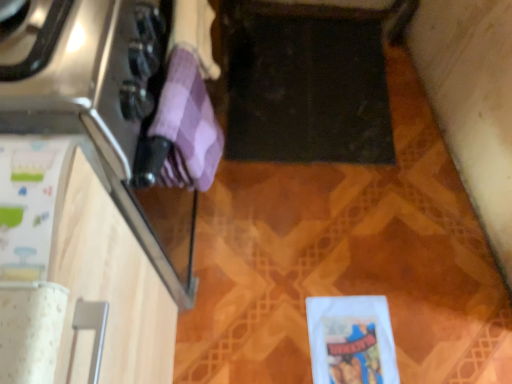
What is the approximate height of white paper at left, marked as the 2th wrapping paper in a top-to-bottom arrangement?

white paper at left, marked as the 2th wrapping paper in a top-to-bottom arrangement, is 2.13 inches tall.

This screenshot has height=384, width=512. What do you see at coordinates (187, 125) in the screenshot? I see `purple checkered towel at left, positioned as the 1th wrapping paper in top-to-bottom order` at bounding box center [187, 125].

Measure the distance between white matte wrapping paper at lower right, marked as the 1th wrapping paper in a bottom-to-top arrangement, and camera.

They are 1.06 meters apart.

Image resolution: width=512 pixels, height=384 pixels. I want to click on white paper at left, marked as the 2th wrapping paper in a top-to-bottom arrangement, so click(x=30, y=203).

From a real-world perspective, which is physically below, white paper at left, marked as the 2th wrapping paper in a top-to-bottom arrangement, or white matte wrapping paper at lower right, the 3th wrapping paper from the left?

From a 3D spatial view, white matte wrapping paper at lower right, the 3th wrapping paper from the left, is below.

Which point is more distant from viewer, [52,219] or [386,316]?

The point [386,316] is behind.

Does white paper at left, which appears as the 2th wrapping paper when ordered from the bottom, have a smaller size compared to white matte wrapping paper at lower right, placed as the first wrapping paper when sorted from right to left?

Incorrect, white paper at left, which appears as the 2th wrapping paper when ordered from the bottom, is not smaller in size than white matte wrapping paper at lower right, placed as the first wrapping paper when sorted from right to left.

Looking at this image, is white paper at left, the third wrapping paper in the right-to-left sequence, looking in the opposite direction of white matte wrapping paper at lower right, placed as the first wrapping paper when sorted from right to left?

No, white paper at left, the third wrapping paper in the right-to-left sequence,'s orientation is not away from white matte wrapping paper at lower right, placed as the first wrapping paper when sorted from right to left.

Do you think white matte wrapping paper at lower right, which is counted as the 3th wrapping paper, starting from the front, is within purple checkered towel at left, positioned as the 1th wrapping paper in top-to-bottom order, or outside of it?

white matte wrapping paper at lower right, which is counted as the 3th wrapping paper, starting from the front, is spatially situated outside purple checkered towel at left, positioned as the 1th wrapping paper in top-to-bottom order.

From a real-world perspective, between white matte wrapping paper at lower right, marked as the 1th wrapping paper in a bottom-to-top arrangement, and purple checkered towel at left, the 2th wrapping paper positioned from the front, who is vertically lower?

white matte wrapping paper at lower right, marked as the 1th wrapping paper in a bottom-to-top arrangement, is physically lower.

Is white matte wrapping paper at lower right, positioned as the first wrapping paper in back-to-front order, oriented towards purple checkered towel at left, positioned as the 1th wrapping paper in top-to-bottom order?

No, white matte wrapping paper at lower right, positioned as the first wrapping paper in back-to-front order, is not turned towards purple checkered towel at left, positioned as the 1th wrapping paper in top-to-bottom order.

Which of these two, white matte wrapping paper at lower right, positioned as the first wrapping paper in back-to-front order, or purple checkered towel at left, which is the 3th wrapping paper in bottom-to-top order, stands taller?

Standing taller between the two is purple checkered towel at left, which is the 3th wrapping paper in bottom-to-top order.

In the scene shown: From a real-world perspective, between white paper at left, which appears as the 2th wrapping paper when ordered from the bottom, and purple checkered towel at left, the 2th wrapping paper positioned from the front, who is vertically higher?

In real-world perspective, white paper at left, which appears as the 2th wrapping paper when ordered from the bottom, is above.

How different are the orientations of white paper at left, which is the first wrapping paper from front to back, and purple checkered towel at left, positioned as the 1th wrapping paper in top-to-bottom order, in degrees?

white paper at left, which is the first wrapping paper from front to back, and purple checkered towel at left, positioned as the 1th wrapping paper in top-to-bottom order, are facing 9.35 degrees away from each other.

Which wrapping paper is the 1st one when counting from the right side of the white paper at left, marked as the 2th wrapping paper in a top-to-bottom arrangement? Please provide its 2D coordinates.

[(187, 125)]

Considering the positions of points (40, 172) and (151, 133), is point (40, 172) closer to camera compared to point (151, 133)?

That is True.

Could you tell me if white matte wrapping paper at lower right, placed as the first wrapping paper when sorted from right to left, is turned towards white paper at left, which appears as the 2th wrapping paper when ordered from the bottom?

No, white matte wrapping paper at lower right, placed as the first wrapping paper when sorted from right to left, is not facing towards white paper at left, which appears as the 2th wrapping paper when ordered from the bottom.

Which is in front, point (361, 349) or point (17, 189)?

Point (17, 189)

From the picture: Between white matte wrapping paper at lower right, positioned as the first wrapping paper in back-to-front order, and white paper at left, marked as the 1th wrapping paper in a left-to-right arrangement, which one has larger width?

white paper at left, marked as the 1th wrapping paper in a left-to-right arrangement, is wider.

From the picture: Does white matte wrapping paper at lower right, which is counted as the 3th wrapping paper, starting from the front, have a larger size compared to white paper at left, marked as the 1th wrapping paper in a left-to-right arrangement?

No.

Between purple checkered towel at left, the 2th wrapping paper positioned from the front, and white matte wrapping paper at lower right, positioned as the first wrapping paper in back-to-front order, which one appears on the right side from the viewer's perspective?

Positioned to the right is white matte wrapping paper at lower right, positioned as the first wrapping paper in back-to-front order.

Is point (193, 113) in front of point (342, 373)?

Yes, point (193, 113) is closer to viewer.

Is purple checkered towel at left, which is the 3th wrapping paper in bottom-to-top order, next to white matte wrapping paper at lower right, the 3th wrapping paper from the left, and touching it?

No.

Is purple checkered towel at left, positioned as the 1th wrapping paper in top-to-bottom order, oriented towards white matte wrapping paper at lower right, marked as the 1th wrapping paper in a bottom-to-top arrangement?

No, purple checkered towel at left, positioned as the 1th wrapping paper in top-to-bottom order, is not turned towards white matte wrapping paper at lower right, marked as the 1th wrapping paper in a bottom-to-top arrangement.

Is purple checkered towel at left, which is the 3th wrapping paper in bottom-to-top order, bigger than white paper at left, which is the first wrapping paper from front to back?

No, purple checkered towel at left, which is the 3th wrapping paper in bottom-to-top order, is not bigger than white paper at left, which is the first wrapping paper from front to back.

From the image's perspective, does purple checkered towel at left, which is the 3th wrapping paper in bottom-to-top order, appear higher than white paper at left, which is the first wrapping paper from front to back?

Yes, from the image's perspective, purple checkered towel at left, which is the 3th wrapping paper in bottom-to-top order, is over white paper at left, which is the first wrapping paper from front to back.

Which is in front, purple checkered towel at left, positioned as the 1th wrapping paper in top-to-bottom order, or white paper at left, marked as the 1th wrapping paper in a left-to-right arrangement?

Positioned in front is white paper at left, marked as the 1th wrapping paper in a left-to-right arrangement.

Visually, is purple checkered towel at left, positioned as the 1th wrapping paper in top-to-bottom order, positioned to the left or to the right of white paper at left, which appears as the 2th wrapping paper when ordered from the bottom?

In the image, purple checkered towel at left, positioned as the 1th wrapping paper in top-to-bottom order, appears on the right side of white paper at left, which appears as the 2th wrapping paper when ordered from the bottom.

At what (x,y) coordinates should I click in order to perform the action: click on wrapping paper that is the 2nd object to the right of the white paper at left, which appears as the 2th wrapping paper when ordered from the bottom, starting at the anchor. Please return your answer as a coordinate pair (x, y). Looking at the image, I should click on (351, 340).

This screenshot has width=512, height=384. In the image, there is a purple checkered towel at left, which is the 3th wrapping paper in bottom-to-top order. Identify the location of wrapping paper below it (from a real-world perspective). (351, 340).

Considering their positions, is white matte wrapping paper at lower right, marked as the 1th wrapping paper in a bottom-to-top arrangement, positioned closer to purple checkered towel at left, which is the second wrapping paper from back to front, than white paper at left, which is the third wrapping paper in back-to-front order?

white paper at left, which is the third wrapping paper in back-to-front order, is closer to purple checkered towel at left, which is the second wrapping paper from back to front.

From the image, which object appears to be farther from white paper at left, which is the first wrapping paper from front to back, purple checkered towel at left, which appears as the 2th wrapping paper when viewed from the right, or white matte wrapping paper at lower right, which is counted as the 3th wrapping paper, starting from the front?

white matte wrapping paper at lower right, which is counted as the 3th wrapping paper, starting from the front.

Which object lies nearer to the anchor point white matte wrapping paper at lower right, positioned as the first wrapping paper in back-to-front order, white paper at left, which is the first wrapping paper from front to back, or purple checkered towel at left, which appears as the 2th wrapping paper when viewed from the right?

purple checkered towel at left, which appears as the 2th wrapping paper when viewed from the right, lies closer to white matte wrapping paper at lower right, positioned as the first wrapping paper in back-to-front order, than the other object.

Which object lies further to the anchor point purple checkered towel at left, the 2th wrapping paper positioned from the front, white paper at left, which is the first wrapping paper from front to back, or white matte wrapping paper at lower right, the 3th wrapping paper from the left?

Among the two, white matte wrapping paper at lower right, the 3th wrapping paper from the left, is located further to purple checkered towel at left, the 2th wrapping paper positioned from the front.

Considering their positions, is white matte wrapping paper at lower right, marked as the 1th wrapping paper in a bottom-to-top arrangement, positioned further to white paper at left, which appears as the 2th wrapping paper when ordered from the bottom, than purple checkered towel at left, which appears as the 2th wrapping paper when viewed from the right?

The object further to white paper at left, which appears as the 2th wrapping paper when ordered from the bottom, is white matte wrapping paper at lower right, marked as the 1th wrapping paper in a bottom-to-top arrangement.

Considering their positions, is purple checkered towel at left, which appears as the 2th wrapping paper when viewed from the right, positioned closer to white matte wrapping paper at lower right, which is counted as the 3th wrapping paper, starting from the front, than white paper at left, which is the third wrapping paper in back-to-front order?

Among the two, purple checkered towel at left, which appears as the 2th wrapping paper when viewed from the right, is located nearer to white matte wrapping paper at lower right, which is counted as the 3th wrapping paper, starting from the front.

Where is `wrapping paper between white paper at left, the third wrapping paper in the right-to-left sequence, and white matte wrapping paper at lower right, the 3th wrapping paper from the left, in the front-back direction`? This screenshot has width=512, height=384. wrapping paper between white paper at left, the third wrapping paper in the right-to-left sequence, and white matte wrapping paper at lower right, the 3th wrapping paper from the left, in the front-back direction is located at coordinates (187, 125).